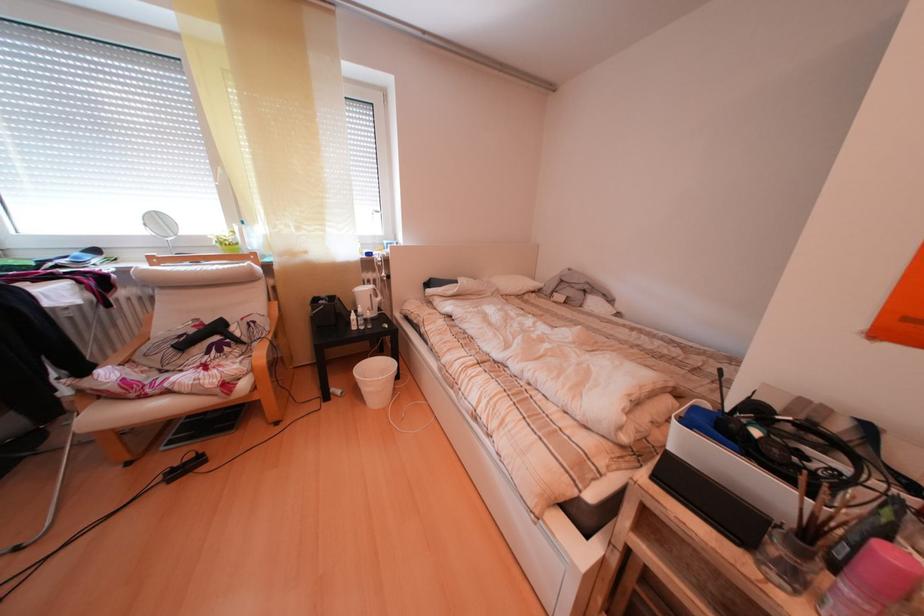
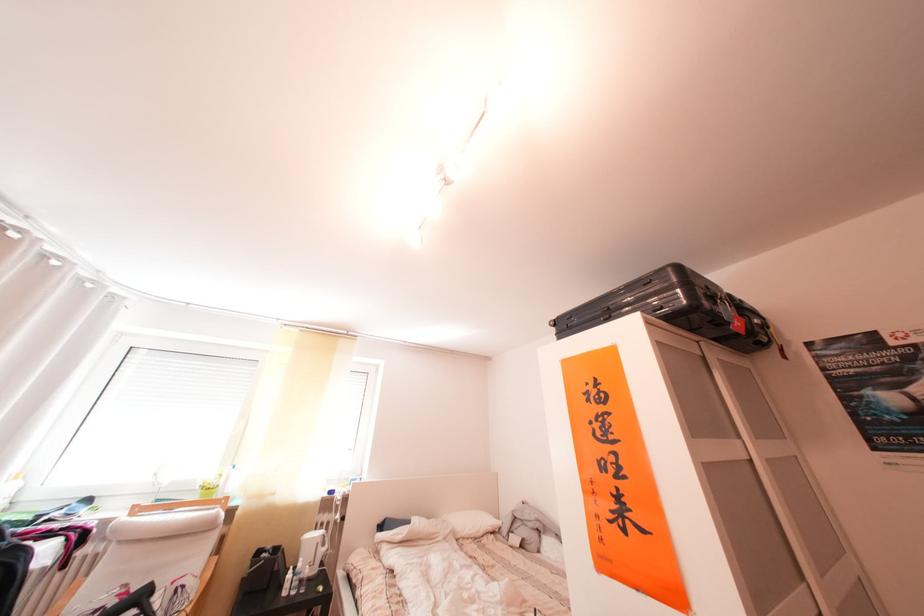
In the second image, find the point that corresponds to point (544, 294) in the first image.

(504, 535)